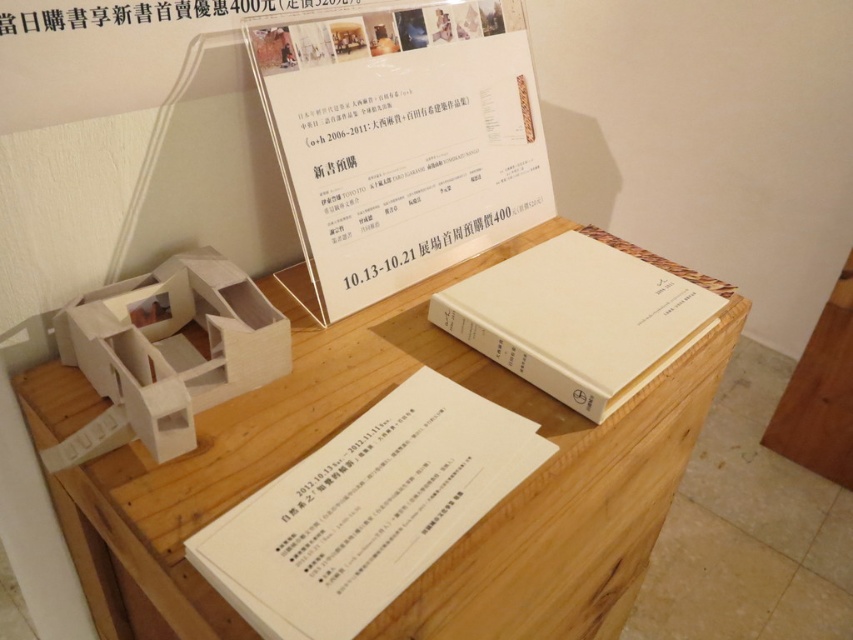
You are a visitor at an exhibition and you see the wooden table at center and the white cardboard model at center. Which object is placed higher from the ground?

The white cardboard model at center is placed higher than the wooden table at center because the wooden table at center is below it.

Where is the white cardboard model at center located in the image?

The white cardboard model at center is located at point (167, 353) in the image.

What object is located at the coordinate point (167, 353) on the display setup?

The point (167, 353) indicates the white cardboard model at center.